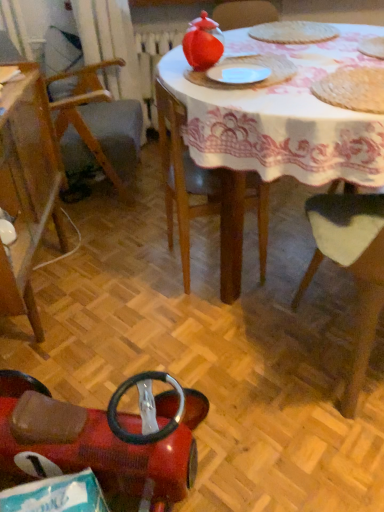
Locate an element on the screen. free space between white matte paper plate at center and matte glass tea pot at upper center is located at coordinates (231, 69).